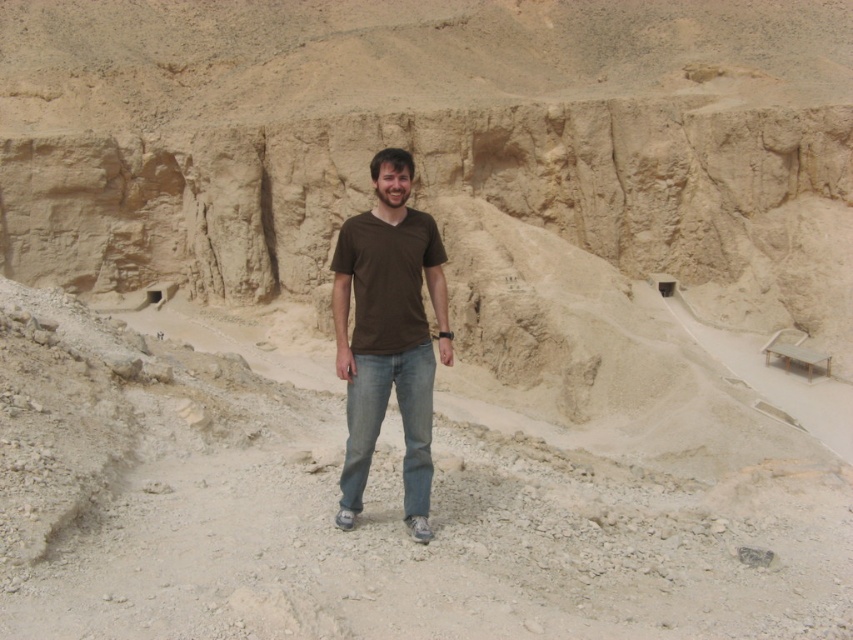
Question: Is brown cotton t-shirt at center thinner than blue denim jeans at center?

Choices:
 (A) yes
 (B) no

Answer: (B)

Question: Is brown cotton t-shirt at center smaller than blue denim jeans at center?

Choices:
 (A) yes
 (B) no

Answer: (B)

Question: Does brown cotton t-shirt at center appear over blue denim jeans at center?

Choices:
 (A) yes
 (B) no

Answer: (A)

Question: Among these objects, which one is nearest to the camera?

Choices:
 (A) brown cotton t-shirt at center
 (B) blue denim jeans at center

Answer: (A)

Question: Among these points, which one is nearest to the camera?

Choices:
 (A) (366, 328)
 (B) (430, 467)

Answer: (B)